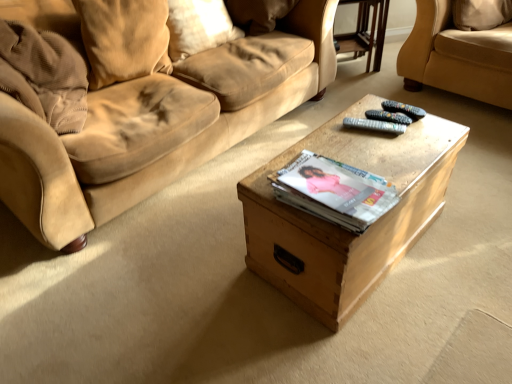
The height and width of the screenshot is (384, 512). Find the location of `vacant space that's between black plastic remote at center, which appears as the second remote when ordered from the bottom, and matte paper magazine at center`. vacant space that's between black plastic remote at center, which appears as the second remote when ordered from the bottom, and matte paper magazine at center is located at coordinates pyautogui.click(x=378, y=148).